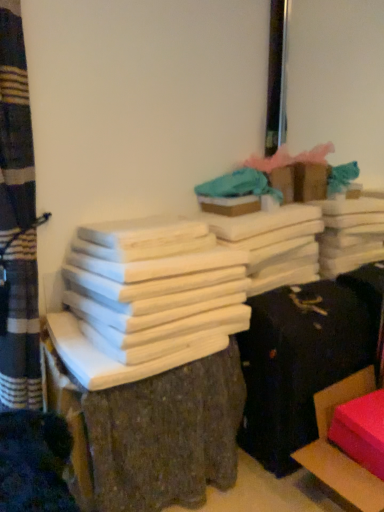
Find the location of a particular element. This screenshot has width=384, height=512. white matte wood at center is located at coordinates (154, 285).

Identify the location of white matte wood at center. (154, 285).

Between rubberized pink cushion at lower right, the 2th furniture in the left-to-right sequence, and smooth wood stack at center, marked as the 1th furniture in a left-to-right arrangement, which one has larger width?

Wider between the two is smooth wood stack at center, marked as the 1th furniture in a left-to-right arrangement.

Considering their positions, is rubberized pink cushion at lower right, the 2th furniture in the left-to-right sequence, located in front of or behind smooth wood stack at center, marked as the 1th furniture in a left-to-right arrangement?

Clearly, rubberized pink cushion at lower right, the 2th furniture in the left-to-right sequence, is behind smooth wood stack at center, marked as the 1th furniture in a left-to-right arrangement.

Does point (231, 189) lie behind point (199, 402)?

Yes, it is behind point (199, 402).

Which of these two, teal fabric at upper center or smooth wood stack at center, acting as the 2th furniture starting from the right, stands taller?

Standing taller between the two is smooth wood stack at center, acting as the 2th furniture starting from the right.

From a real-world perspective, count 1st furnitures downward from the teal fabric at upper center and point to it. Please provide its 2D coordinates.

[(166, 434)]

Is smooth wood stack at center, acting as the 2th furniture starting from the right, located within teal fabric at upper center?

No, smooth wood stack at center, acting as the 2th furniture starting from the right, is not surrounded by teal fabric at upper center.

From a real-world perspective, is white matte wood at center over teal fabric at upper center?

No, from a real-world perspective, white matte wood at center is not above teal fabric at upper center.

Between white matte wood at center and teal fabric at upper center, which one has larger width?

white matte wood at center.

This screenshot has width=384, height=512. Find the location of `bundle located on the left of teal fabric at upper center`. bundle located on the left of teal fabric at upper center is located at coordinates (154, 285).

Consider the image. Who is more distant, smooth wood stack at center, acting as the 2th furniture starting from the right, or teal fabric at upper center?

teal fabric at upper center is behind.

Which of these two, smooth wood stack at center, acting as the 2th furniture starting from the right, or teal fabric at upper center, is bigger?

Bigger between the two is smooth wood stack at center, acting as the 2th furniture starting from the right.

Can you confirm if smooth wood stack at center, marked as the 1th furniture in a left-to-right arrangement, is shorter than teal fabric at upper center?

No.

How distant is smooth wood stack at center, acting as the 2th furniture starting from the right, from teal fabric at upper center?

smooth wood stack at center, acting as the 2th furniture starting from the right, and teal fabric at upper center are 97.08 centimeters apart.

From a real-world perspective, is rubberized pink cushion at lower right, arranged as the first furniture when viewed from the right, on top of white matte wood at center?

No, from a real-world perspective, rubberized pink cushion at lower right, arranged as the first furniture when viewed from the right, is not on top of white matte wood at center.

Who is smaller, rubberized pink cushion at lower right, arranged as the first furniture when viewed from the right, or white matte wood at center?

Smaller between the two is white matte wood at center.

Locate an element on the screen. This screenshot has width=384, height=512. bundle behind the rubberized pink cushion at lower right, the 2th furniture in the left-to-right sequence is located at coordinates (154, 285).

Is white matte wood at center surrounded by rubberized pink cushion at lower right, arranged as the first furniture when viewed from the right?

No, white matte wood at center is not inside rubberized pink cushion at lower right, arranged as the first furniture when viewed from the right.

Can you confirm if rubberized pink cushion at lower right, the 2th furniture in the left-to-right sequence, is shorter than teal fabric at upper center?

No, rubberized pink cushion at lower right, the 2th furniture in the left-to-right sequence, is not shorter than teal fabric at upper center.

Can you tell me how much rubberized pink cushion at lower right, arranged as the first furniture when viewed from the right, and teal fabric at upper center differ in facing direction?

They differ by 86.4 degrees in their facing directions.

Is rubberized pink cushion at lower right, the 2th furniture in the left-to-right sequence, facing towards teal fabric at upper center?

No, rubberized pink cushion at lower right, the 2th furniture in the left-to-right sequence, does not turn towards teal fabric at upper center.

Does rubberized pink cushion at lower right, the 2th furniture in the left-to-right sequence, have a greater width compared to teal fabric at upper center?

Correct, the width of rubberized pink cushion at lower right, the 2th furniture in the left-to-right sequence, exceeds that of teal fabric at upper center.

Is rubberized pink cushion at lower right, arranged as the first furniture when viewed from the right, a part of smooth wood stack at center, acting as the 2th furniture starting from the right?

That's incorrect, rubberized pink cushion at lower right, arranged as the first furniture when viewed from the right, is not inside smooth wood stack at center, acting as the 2th furniture starting from the right.

How far apart are smooth wood stack at center, marked as the 1th furniture in a left-to-right arrangement, and rubberized pink cushion at lower right, arranged as the first furniture when viewed from the right?

They are 52.34 centimeters apart.

Can you confirm if smooth wood stack at center, marked as the 1th furniture in a left-to-right arrangement, is smaller than rubberized pink cushion at lower right, the 2th furniture in the left-to-right sequence?

No.

Is smooth wood stack at center, marked as the 1th furniture in a left-to-right arrangement, facing towards rubberized pink cushion at lower right, arranged as the first furniture when viewed from the right?

No, smooth wood stack at center, marked as the 1th furniture in a left-to-right arrangement, is not oriented towards rubberized pink cushion at lower right, arranged as the first furniture when viewed from the right.

Identify the location of furniture in front of the rubberized pink cushion at lower right, the 2th furniture in the left-to-right sequence. (166, 434).

This screenshot has height=512, width=384. I want to click on fabric located above the smooth wood stack at center, marked as the 1th furniture in a left-to-right arrangement (from a real-world perspective), so click(239, 185).

Which object lies nearer to the anchor point teal fabric at upper center, smooth wood stack at center, acting as the 2th furniture starting from the right, or rubberized pink cushion at lower right, arranged as the first furniture when viewed from the right?

smooth wood stack at center, acting as the 2th furniture starting from the right.

From the image, which object appears to be nearer to smooth wood stack at center, acting as the 2th furniture starting from the right, teal fabric at upper center or white matte wood at center?

white matte wood at center lies closer to smooth wood stack at center, acting as the 2th furniture starting from the right, than the other object.

When comparing their distances from smooth wood stack at center, acting as the 2th furniture starting from the right, does rubberized pink cushion at lower right, arranged as the first furniture when viewed from the right, or teal fabric at upper center seem further?

Among the two, teal fabric at upper center is located further to smooth wood stack at center, acting as the 2th furniture starting from the right.

From the image, which object appears to be nearer to rubberized pink cushion at lower right, the 2th furniture in the left-to-right sequence, white matte wood at center or teal fabric at upper center?

white matte wood at center lies closer to rubberized pink cushion at lower right, the 2th furniture in the left-to-right sequence, than the other object.

Looking at the image, which one is located closer to white matte wood at center, teal fabric at upper center or rubberized pink cushion at lower right, the 2th furniture in the left-to-right sequence?

The object closer to white matte wood at center is teal fabric at upper center.

Estimate the real-world distances between objects in this image. Which object is closer to teal fabric at upper center, smooth wood stack at center, acting as the 2th furniture starting from the right, or white matte wood at center?

The object closer to teal fabric at upper center is white matte wood at center.

Considering their positions, is rubberized pink cushion at lower right, the 2th furniture in the left-to-right sequence, positioned further to white matte wood at center than smooth wood stack at center, acting as the 2th furniture starting from the right?

Based on the image, rubberized pink cushion at lower right, the 2th furniture in the left-to-right sequence, appears to be further to white matte wood at center.

Considering their positions, is white matte wood at center positioned closer to smooth wood stack at center, marked as the 1th furniture in a left-to-right arrangement, than teal fabric at upper center?

Among the two, white matte wood at center is located nearer to smooth wood stack at center, marked as the 1th furniture in a left-to-right arrangement.

Identify the location of furniture between teal fabric at upper center and rubberized pink cushion at lower right, the 2th furniture in the left-to-right sequence, in the vertical direction. This screenshot has height=512, width=384. (166, 434).

Locate an element on the screen. bundle between teal fabric at upper center and smooth wood stack at center, marked as the 1th furniture in a left-to-right arrangement, from top to bottom is located at coordinates (154, 285).

Identify the location of bundle between teal fabric at upper center and rubberized pink cushion at lower right, the 2th furniture in the left-to-right sequence, in the up-down direction. (154, 285).

Find the location of a particular element. Image resolution: width=384 pixels, height=512 pixels. bundle situated between smooth wood stack at center, acting as the 2th furniture starting from the right, and rubberized pink cushion at lower right, the 2th furniture in the left-to-right sequence, from left to right is located at coordinates (154, 285).